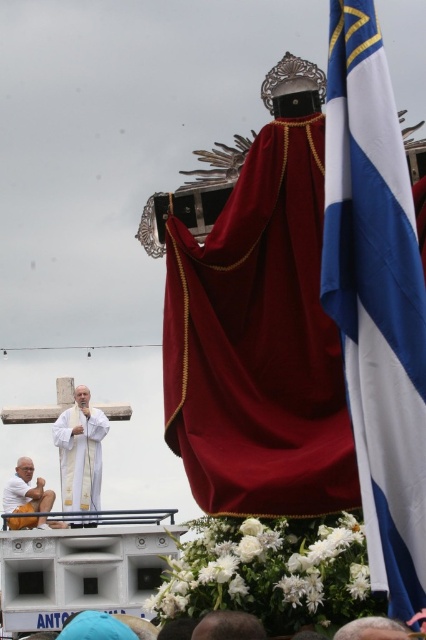
Question: Is white matte statue at lower left to the right of brown hair at lower center from the viewer's perspective?

Choices:
 (A) no
 (B) yes

Answer: (A)

Question: Which of the following is the closest to the observer?

Choices:
 (A) (227, 621)
 (B) (11, 516)
 (C) (382, 273)

Answer: (A)

Question: Which point is closer to the camera?

Choices:
 (A) (270, 440)
 (B) (397, 292)
 (C) (81, 486)
 (D) (354, 627)

Answer: (D)

Question: Does white matte statue at lower left appear on the left side of white cotton robe at lower left?

Choices:
 (A) no
 (B) yes

Answer: (A)

Question: Can you confirm if brown hair at lower center is wider than smooth brown leather hat at lower center?

Choices:
 (A) yes
 (B) no

Answer: (A)

Question: Which point is farther to the camera?

Choices:
 (A) (356, 65)
 (B) (199, 627)
 (C) (226, 364)
 (D) (25, 481)

Answer: (D)